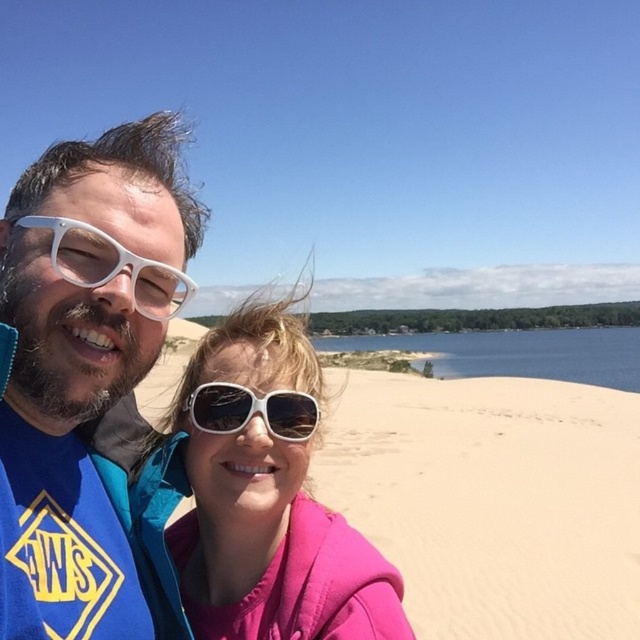
Question: Is sandy yellow sand at center positioned before white matte sunglasses at center?

Choices:
 (A) no
 (B) yes

Answer: (A)

Question: From the image, what is the correct spatial relationship of pink matte jacket at center in relation to white matte sunglasses at center?

Choices:
 (A) above
 (B) below

Answer: (B)

Question: Where is pink matte jacket at center located in relation to white matte sunglasses at center in the image?

Choices:
 (A) right
 (B) left

Answer: (B)

Question: Which point is farther to the camera?

Choices:
 (A) pink matte jacket at center
 (B) white matte sunglasses at center
 (C) sandy yellow sand at center

Answer: (C)

Question: Which object is positioned farthest from the white matte sunglasses at center?

Choices:
 (A) pink matte jacket at center
 (B) white plastic glasses at left
 (C) white matte sunglasses at upper left

Answer: (B)

Question: Which point appears farthest from the camera in this image?

Choices:
 (A) (81, 278)
 (B) (195, 403)
 (C) (380, 432)
 (D) (314, 529)

Answer: (C)